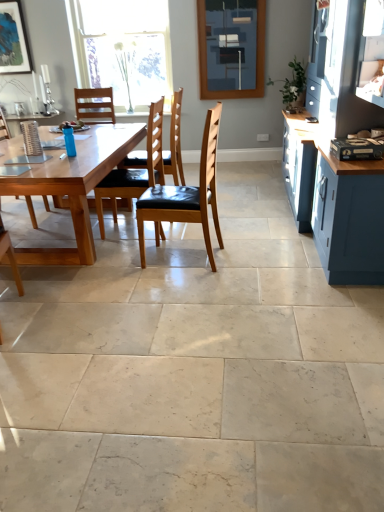
Identify the location of free space in front of natural wood table at center. Image resolution: width=384 pixels, height=512 pixels. (110, 328).